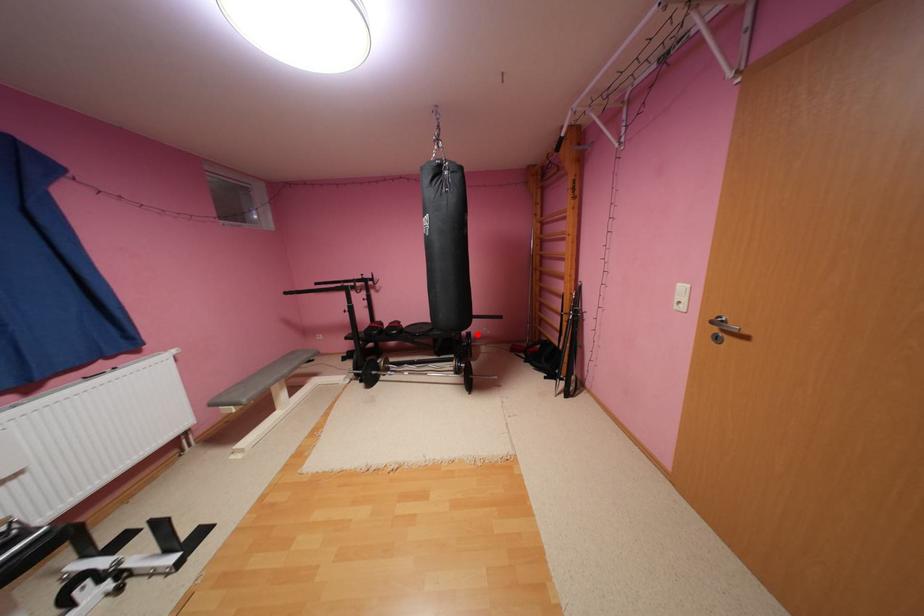
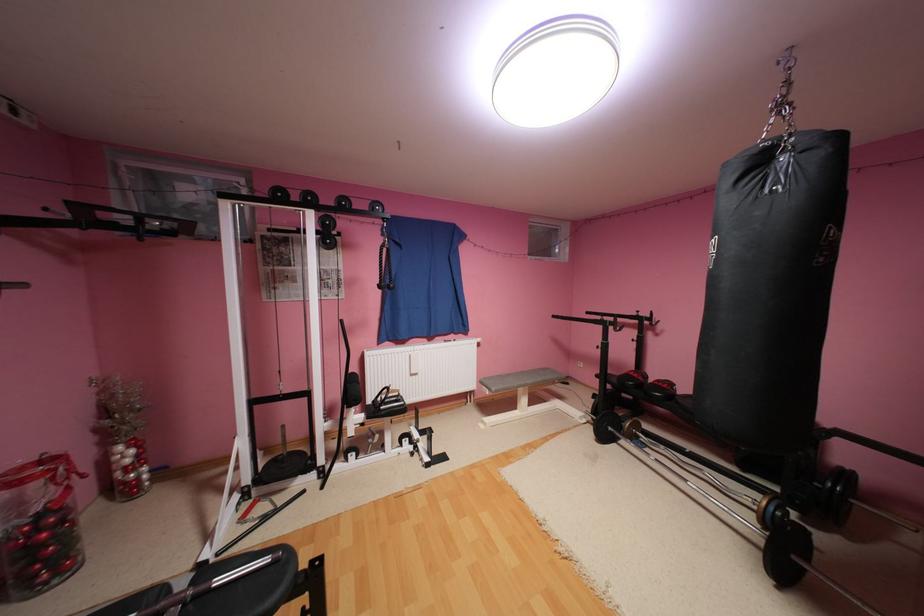
Question: I am providing you with two images of the same scene from different viewpoints. Image1 has a red point marked. In image2, the corresponding 3D location appears at what relative position? Reply with the corresponding letter.

Choices:
 (A) Closer
 (B) Farther

Answer: (A)